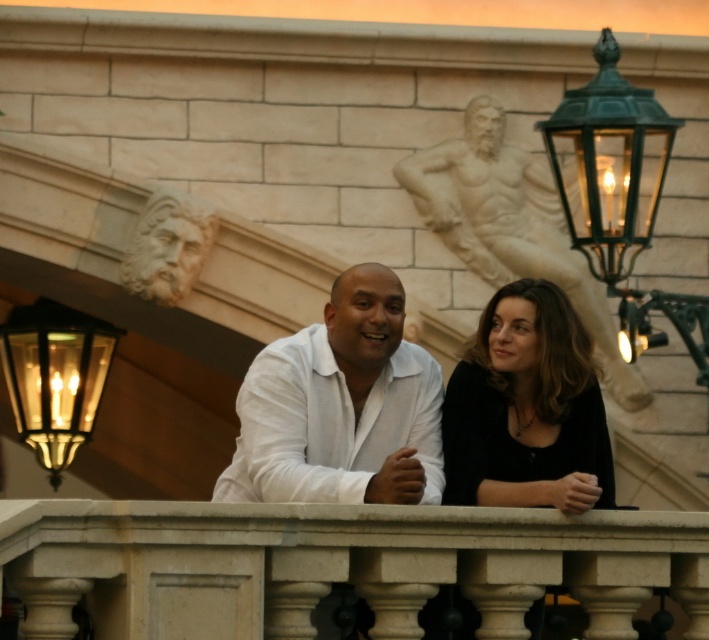
Question: Which is nearer to the white matte shirt at center?

Choices:
 (A) carved stone head at upper center
 (B) black matte shirt at center
 (C) green glass lantern at upper right
 (D) white stone statue at upper center

Answer: (B)

Question: Is white marble balustrade at center wider than black matte shirt at center?

Choices:
 (A) no
 (B) yes

Answer: (B)

Question: Estimate the real-world distances between objects in this image. Which object is closer to the black matte shirt at center?

Choices:
 (A) white stone statue at upper center
 (B) carved stone head at upper center
 (C) white marble balustrade at center
 (D) matte brass lantern at left

Answer: (C)

Question: Does green glass lantern at upper right have a greater width compared to white stone statue at upper center?

Choices:
 (A) no
 (B) yes

Answer: (A)

Question: Where is white matte shirt at center located in relation to white stone statue at upper center in the image?

Choices:
 (A) below
 (B) above

Answer: (A)

Question: Which object is the farthest from the black matte shirt at center?

Choices:
 (A) white matte shirt at center
 (B) green glass lantern at upper right
 (C) matte brass lantern at left
 (D) carved stone head at upper center

Answer: (C)